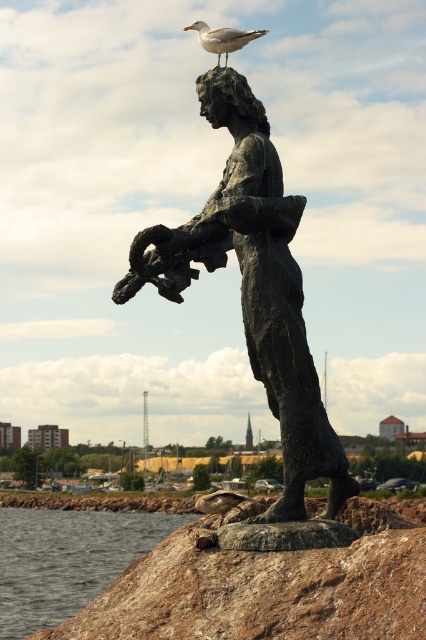
Question: Is bronze statue at center to the left of white feathered seagull at upper center from the viewer's perspective?

Choices:
 (A) no
 (B) yes

Answer: (A)

Question: Does bronze statue at center appear on the left side of smooth gray water at lower left?

Choices:
 (A) no
 (B) yes

Answer: (A)

Question: Which point is farther to the camera?

Choices:
 (A) (230, 51)
 (B) (55, 618)

Answer: (B)

Question: Which point is closer to the camera?

Choices:
 (A) (5, 628)
 (B) (207, 29)
 (C) (250, 323)

Answer: (C)

Question: Is the position of bronze statue at center less distant than that of white feathered seagull at upper center?

Choices:
 (A) yes
 (B) no

Answer: (A)

Question: Among these objects, which one is nearest to the camera?

Choices:
 (A) white feathered seagull at upper center
 (B) bronze statue at center

Answer: (B)